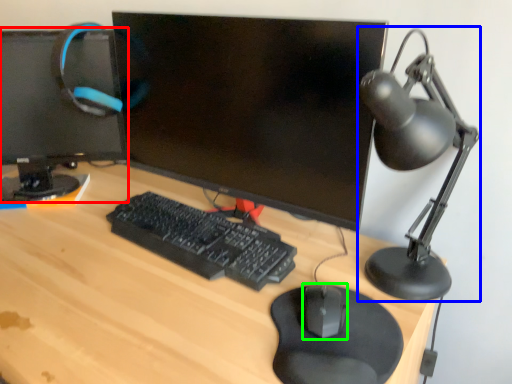
Question: Which is nearer to the computer monitor (highlighted by a red box)? table lamp (highlighted by a blue box) or mouse (highlighted by a green box).

Choices:
 (A) table lamp
 (B) mouse

Answer: (A)